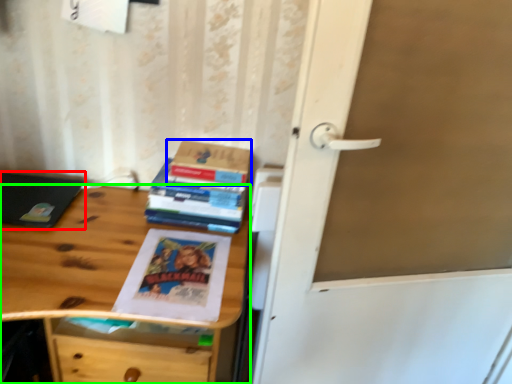
Question: Which object is the farthest from laptop (highlighted by a red box)? Choose among these: paperback book (highlighted by a blue box) or desk (highlighted by a green box).

Choices:
 (A) paperback book
 (B) desk

Answer: (A)